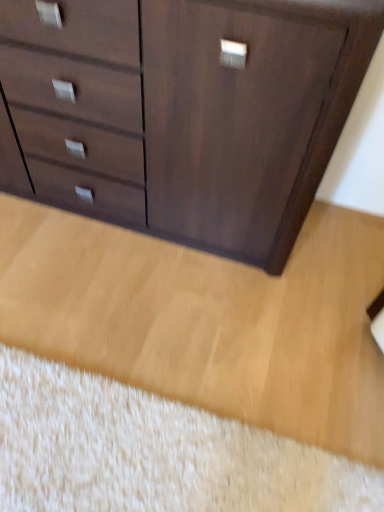
Locate an element on the screen. white fluffy rug at lower left is located at coordinates (152, 452).

The width and height of the screenshot is (384, 512). What do you see at coordinates (152, 452) in the screenshot? I see `white fluffy rug at lower left` at bounding box center [152, 452].

Where is `white fluffy rug at lower left`? The height and width of the screenshot is (512, 384). white fluffy rug at lower left is located at coordinates (152, 452).